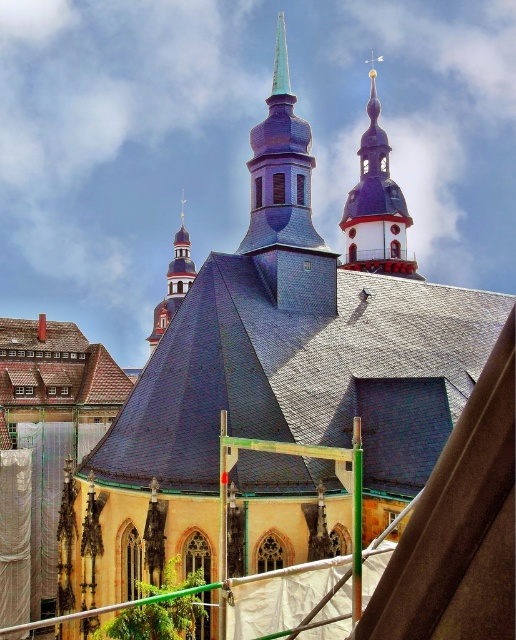
Is purple matte steeple at upper center wider than smooth red wood spire at upper left?

Yes.

How distant is purple matte steeple at upper center from smooth red wood spire at upper left?

The distance of purple matte steeple at upper center from smooth red wood spire at upper left is 215.27 feet.

Who is more distant from viewer, (350, 259) or (175, 276)?

Positioned behind is point (175, 276).

Where is `purple matte steeple at upper center`? Image resolution: width=516 pixels, height=640 pixels. purple matte steeple at upper center is located at coordinates (376, 205).